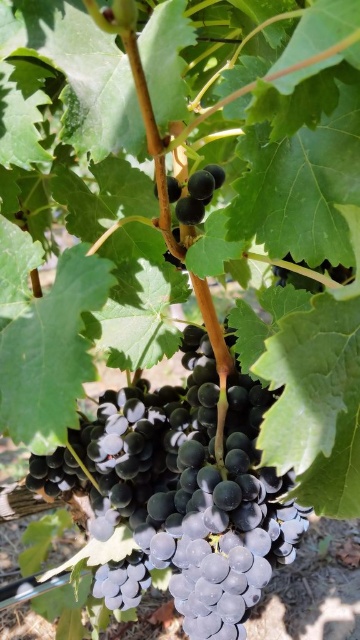
Who is higher up, shiny purple grapes at center or shiny dark purple grape at center?

Positioned higher is shiny dark purple grape at center.

Between shiny purple grapes at center and shiny dark purple grape at center, which one has less height?

shiny dark purple grape at center is shorter.

Image resolution: width=360 pixels, height=640 pixels. I want to click on shiny purple grapes at center, so click(x=181, y=493).